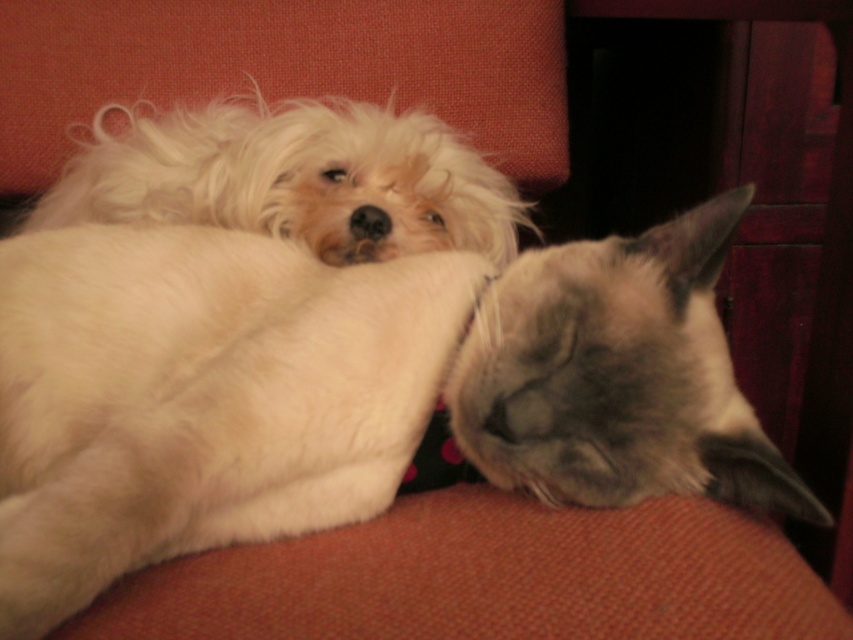
Is gray fur cat at center wider than white fluffy dog at upper left?

Incorrect, gray fur cat at center's width does not surpass white fluffy dog at upper left's.

Can you confirm if gray fur cat at center is positioned below white fluffy dog at upper left?

Correct, gray fur cat at center is located below white fluffy dog at upper left.

Between point (640, 428) and point (216, 173), which one is positioned in front?

Positioned in front is point (640, 428).

Identify the location of gray fur cat at center. (618, 376).

Can you confirm if silvery-gray fur cat at upper center is thinner than white fluffy dog at upper left?

Yes, silvery-gray fur cat at upper center is thinner than white fluffy dog at upper left.

Is silvery-gray fur cat at upper center closer to the viewer compared to white fluffy dog at upper left?

Yes, it is in front of white fluffy dog at upper left.

Which is in front, point (372, 342) or point (61, 177)?

Point (372, 342)

You are a GUI agent. You are given a task and a screenshot of the screen. Output one action in this format:
    pyautogui.click(x=<x>, y=<y>)
    Task: Click on the silvery-gray fur cat at upper center
    
    Given the screenshot: What is the action you would take?
    pyautogui.click(x=349, y=390)

Is point (267, 406) positioned in front of point (561, 481)?

That is True.

Who is more distant from viewer, [312,477] or [503,275]?

The point [503,275] is behind.

Image resolution: width=853 pixels, height=640 pixels. Identify the location of silvery-gray fur cat at upper center. (349, 390).